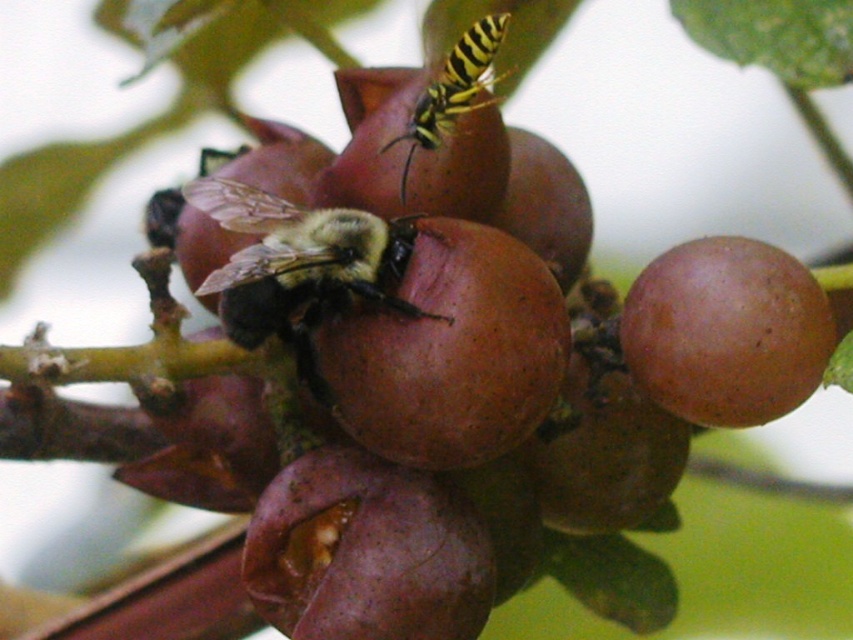
You are a fruit inspector checking the cluster of fruits. You notice the brown matte fruit at center and the purple matte grape at center. Which one is taller?

The brown matte fruit at center is taller than the purple matte grape at center.

You are an insect collector observing the scene. You need to capture the black fuzzy bee at center without disturbing the brown matte fruit at center. Which direction should you approach from?

The brown matte fruit at center is positioned on the right side of the black fuzzy bee at center. Therefore, you should approach from the left side of the black fuzzy bee at center to avoid disturbing the fruit.

You are a beekeeper examining the cluster of fruits. You notice the brown matte fruit at center and the brown matte grape at center. Which one is positioned lower in the cluster?

The brown matte fruit at center is located below the brown matte grape at center, so it is positioned lower in the cluster.